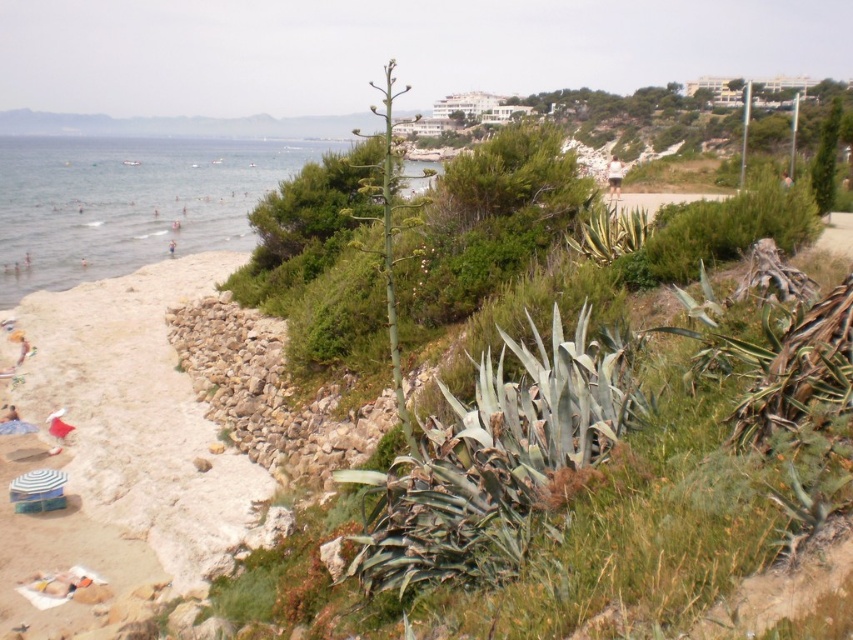
Can you confirm if beige sand at lower left is positioned above clear blue water at beach left?

No.

Who is shorter, beige sand at lower left or clear blue water at beach left?

Standing shorter between the two is beige sand at lower left.

This screenshot has width=853, height=640. I want to click on beige sand at lower left, so click(x=134, y=432).

Does clear blue water at beach left have a larger size compared to white cotton shorts at upper right?

Yes.

From the picture: Can you confirm if clear blue water at beach left is positioned to the left of white cotton shorts at upper right?

Yes, clear blue water at beach left is to the left of white cotton shorts at upper right.

Is point (123, 177) less distant than point (618, 179)?

No, it is behind (618, 179).

I want to click on clear blue water at beach left, so click(128, 202).

Which is more to the right, white fabric at lower left or white cotton shorts at upper right?

white cotton shorts at upper right is more to the right.

Measure the distance from white fabric at lower left to white cotton shorts at upper right.

A distance of 76.19 feet exists between white fabric at lower left and white cotton shorts at upper right.

Where is `white fabric at lower left`? This screenshot has height=640, width=853. white fabric at lower left is located at coordinates (57, 424).

Where is `white fabric at lower left`? Image resolution: width=853 pixels, height=640 pixels. white fabric at lower left is located at coordinates (57, 424).